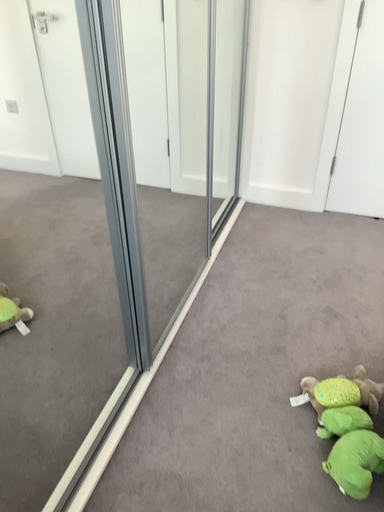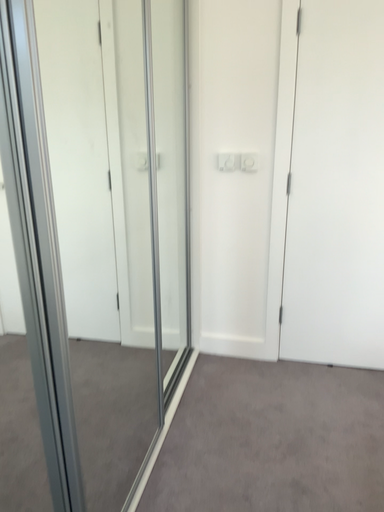
Question: Which way did the camera rotate in the video?

Choices:
 (A) rotated downward
 (B) rotated upward

Answer: (B)